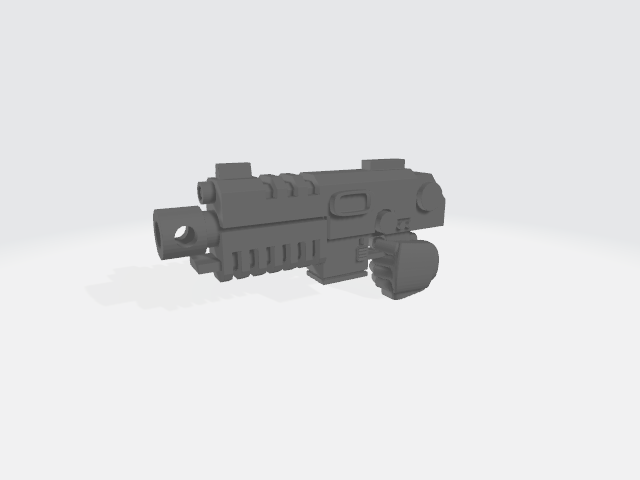
The width and height of the screenshot is (640, 480). In order to click on projector in this screenshot , I will do `click(186, 237)`, `click(154, 241)`.